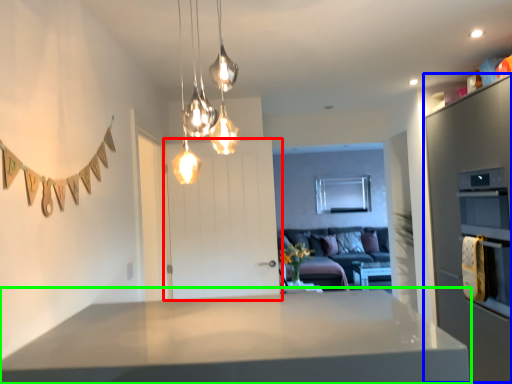
Question: Estimate the real-world distances between objects in this image. Which object is farther from door (highlighted by a red box), cabinetry (highlighted by a blue box) or countertop (highlighted by a green box)?

Choices:
 (A) cabinetry
 (B) countertop

Answer: (B)